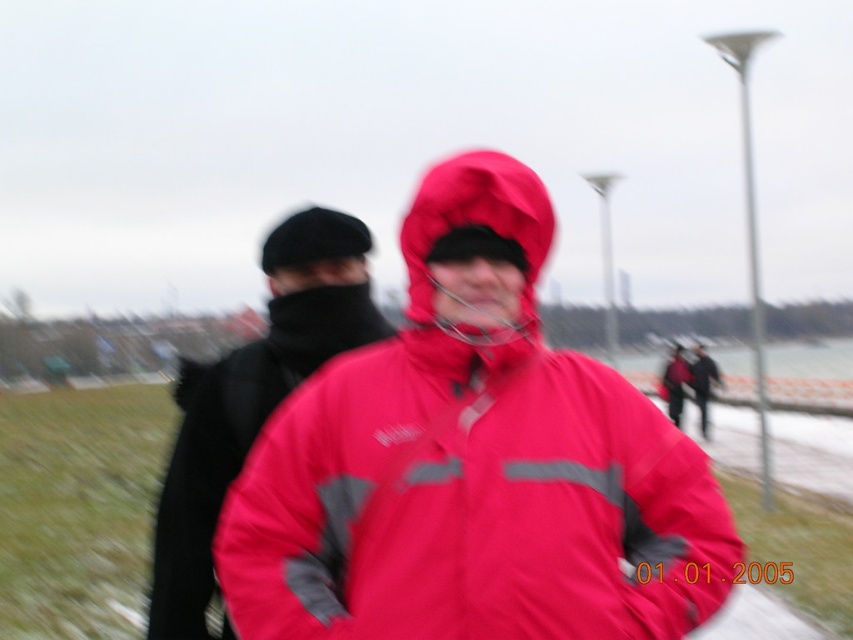
Can you confirm if matte pink jacket at center is positioned below black matte jacket at left?

Yes.

Is point (442, 570) less distant than point (299, 305)?

Yes.

Who is more forward, (x=259, y=560) or (x=254, y=404)?

Point (x=259, y=560)

Where is `matte pink jacket at center`? matte pink jacket at center is located at coordinates (473, 465).